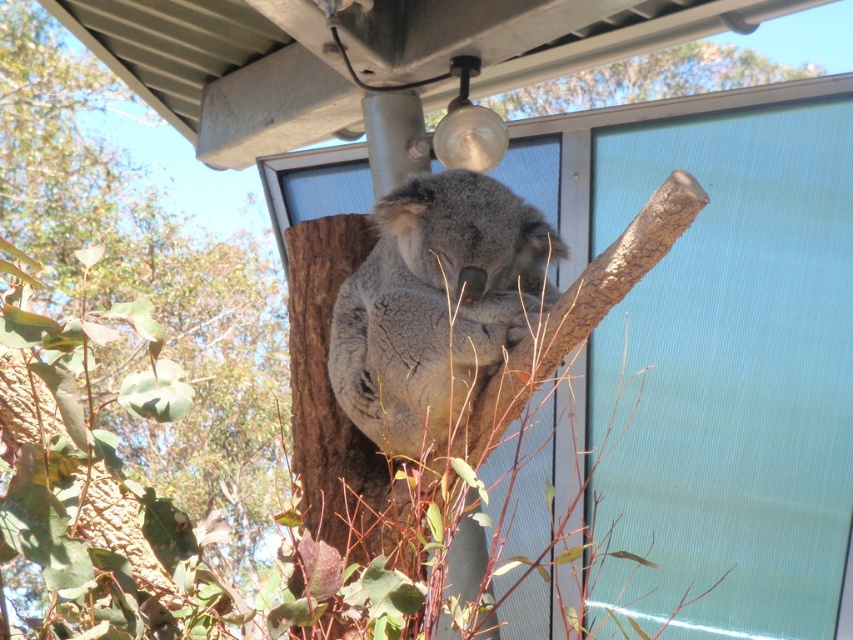
You are a photographer aiming to capture the brown rough bark tree at center and the brown rough bark at upper center in a single shot. Which object should you focus on first to ensure both are in frame?

You should focus on the brown rough bark tree at center first because it is closer to you than the brown rough bark at upper center, ensuring both are in frame.

You are a zookeeper checking the enclosure. You need to ensure the gray furry koala at center has enough space to move around on the brown rough bark tree at center. Based on their sizes, can the koala comfortably move on the tree?

The brown rough bark tree at center is wider than the gray furry koala at center, so the koala should have enough space to move comfortably on the tree.

You are a zookeeper observing the koala in its enclosure. You notice a point marked at coordinates (146, 284). Which object in the scene does this point correspond to?

The point at coordinates (146, 284) corresponds to the brown rough bark tree at center.